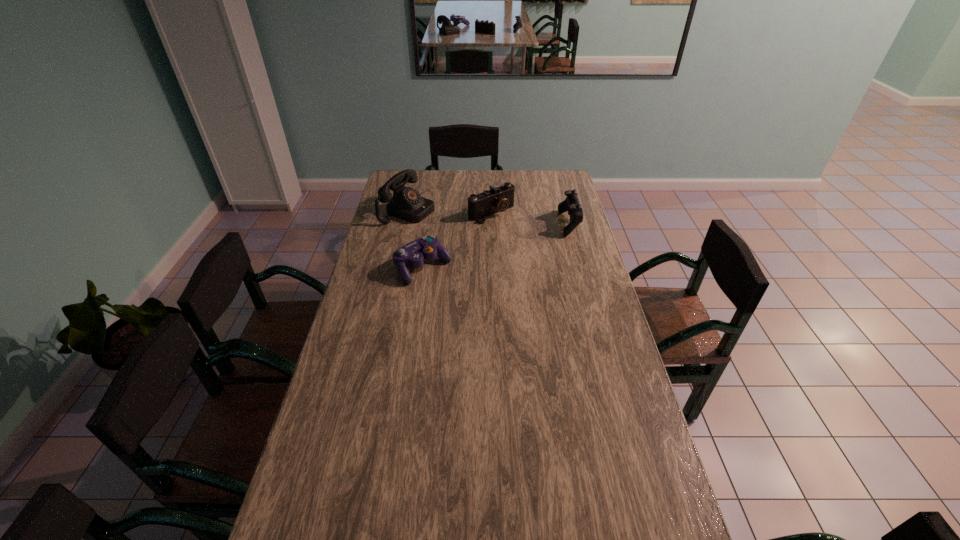
You are a GUI agent. You are given a task and a screenshot of the screen. Output one action in this format:
    pyautogui.click(x=<x>, y=<y>)
    Task: Click on the nearer control
    
    Given the screenshot: What is the action you would take?
    pyautogui.click(x=412, y=254)

Identify the location of the shortest object. (412, 254).

You are a GUI agent. You are given a task and a screenshot of the screen. Output one action in this format:
    pyautogui.click(x=<x>, y=<y>)
    Task: Click on the right control
    The height and width of the screenshot is (540, 960).
    Given the screenshot: What is the action you would take?
    pyautogui.click(x=571, y=204)

Identify the location of the farther control. (571, 204).

Where is `telephone`? The width and height of the screenshot is (960, 540). telephone is located at coordinates (407, 204).

I want to click on the third object from left to right, so click(498, 199).

Locate an element on the screen. This screenshot has height=540, width=960. vacant space located on the front of the nearer control is located at coordinates (411, 347).

I want to click on free region located on the dial of the tallest object, so click(487, 238).

What are the coordinates of `free space located 0.350m on the dial of the tallest object` in the screenshot? It's located at pyautogui.click(x=499, y=242).

Where is `free location located on the dial of the tallest object`? free location located on the dial of the tallest object is located at coordinates (458, 228).